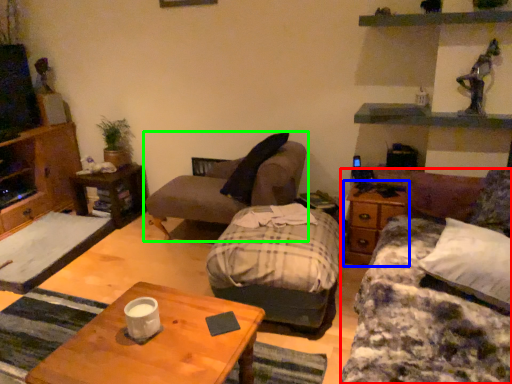
Question: Considering the real-world distances, which object is farthest from studio couch (highlighted by a red box)? side table (highlighted by a blue box) or chair (highlighted by a green box)?

Choices:
 (A) side table
 (B) chair

Answer: (B)